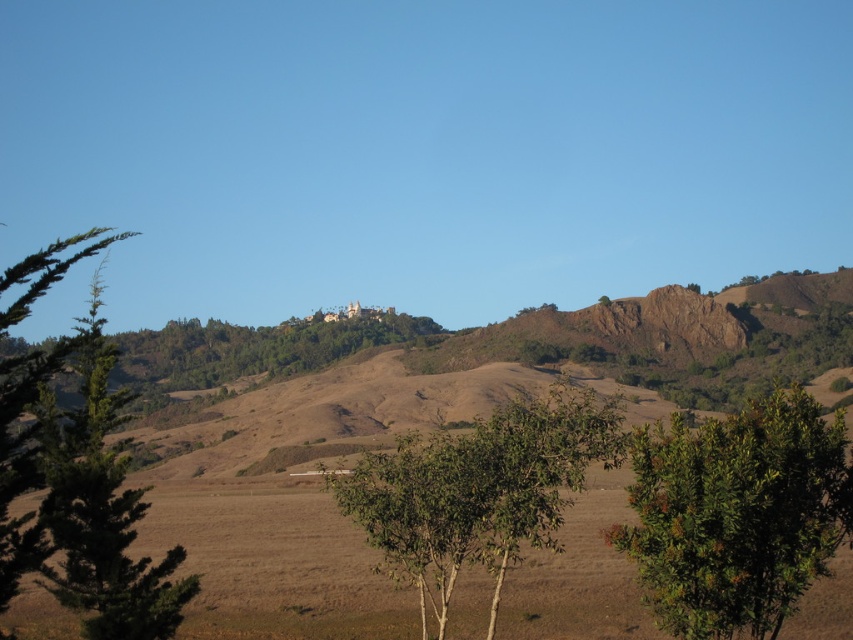
Between brown grassy hillside at center and green leafy tree at lower right, which one has more height?

brown grassy hillside at center is taller.

Does brown grassy hillside at center appear over green leafy tree at lower right?

Yes.

Is point (550, 346) behind point (637, 502)?

Yes, it is.

This screenshot has height=640, width=853. In order to click on brown grassy hillside at center in this screenshot , I will do `click(672, 339)`.

Which of these two, green leafy tree at lower right or green leafy tree at left, stands shorter?

green leafy tree at lower right

Is green leafy tree at lower right shorter than green leafy tree at left?

Yes, green leafy tree at lower right is shorter than green leafy tree at left.

Locate an element on the screen. The image size is (853, 640). green leafy tree at lower right is located at coordinates (735, 515).

Is point (833, 330) closer to camera compared to point (508, 486)?

No, it is not.

Is brown grassy hillside at center to the right of green leafy tree at center from the viewer's perspective?

No, brown grassy hillside at center is not to the right of green leafy tree at center.

Does point (234, 362) lie in front of point (489, 525)?

That is False.

You are a GUI agent. You are given a task and a screenshot of the screen. Output one action in this format:
    pyautogui.click(x=<x>, y=<y>)
    Task: Click on the brown grassy hillside at center
    Image resolution: width=853 pixels, height=640 pixels.
    Given the screenshot: What is the action you would take?
    pyautogui.click(x=672, y=339)